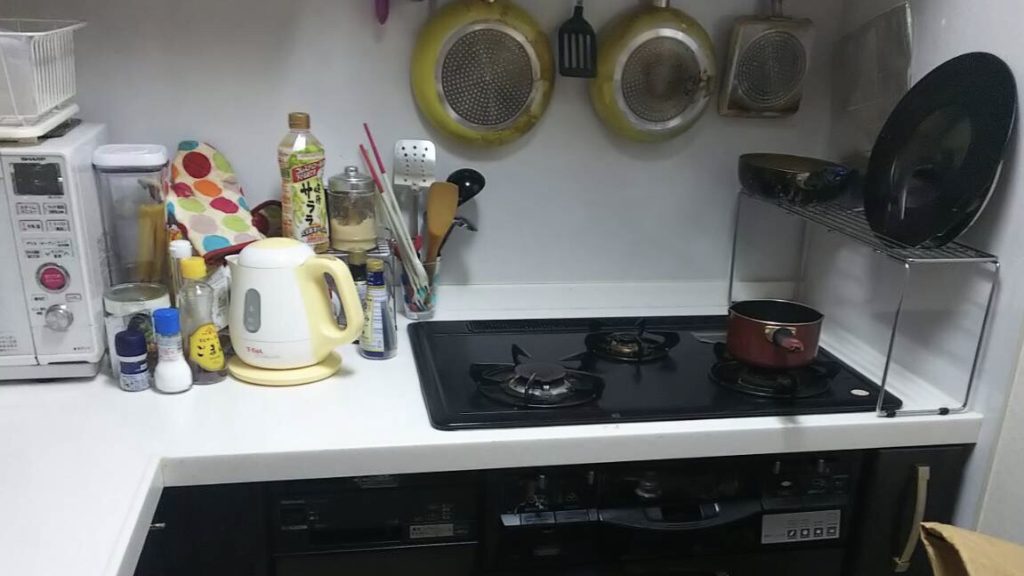
Find the location of a particular element. handle of oven door is located at coordinates (684, 525).